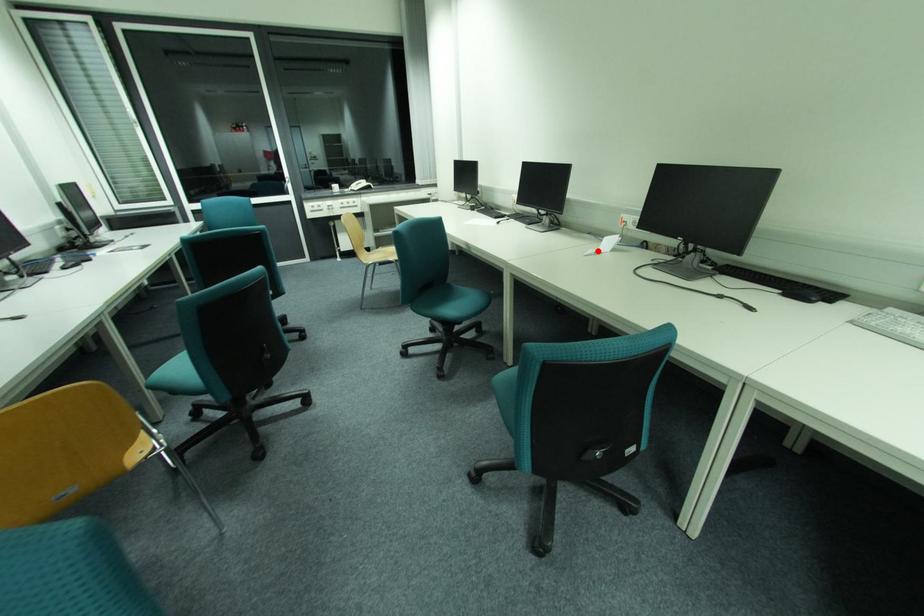
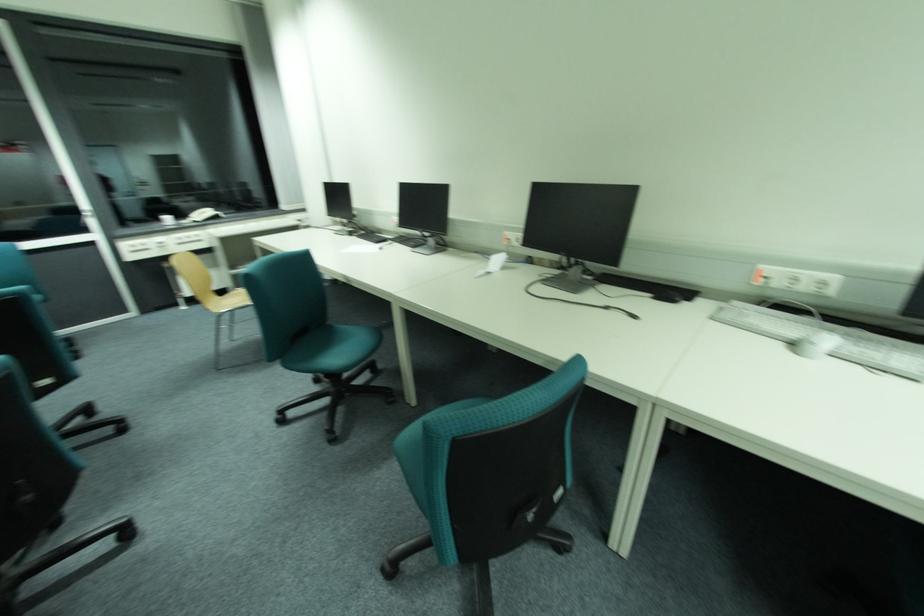
Where in the second image is the point corresponding to the highlighted location from the first image?

(487, 272)